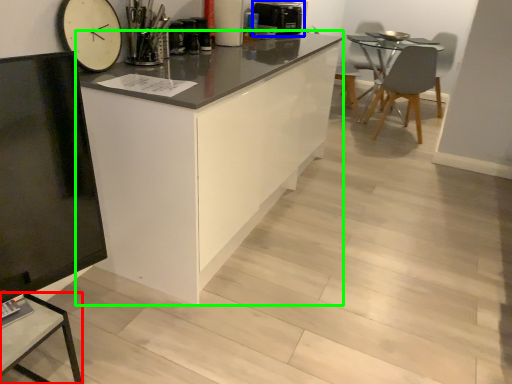
Question: Which object is the closest to the table (highlighted by a red box)? Choose among these: appliance (highlighted by a blue box) or cabinetry (highlighted by a green box).

Choices:
 (A) appliance
 (B) cabinetry

Answer: (B)